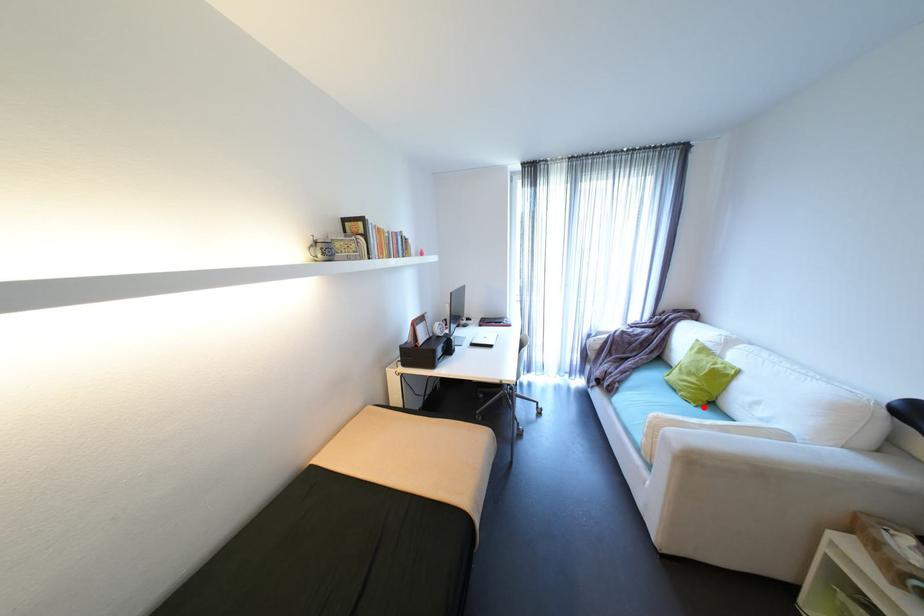
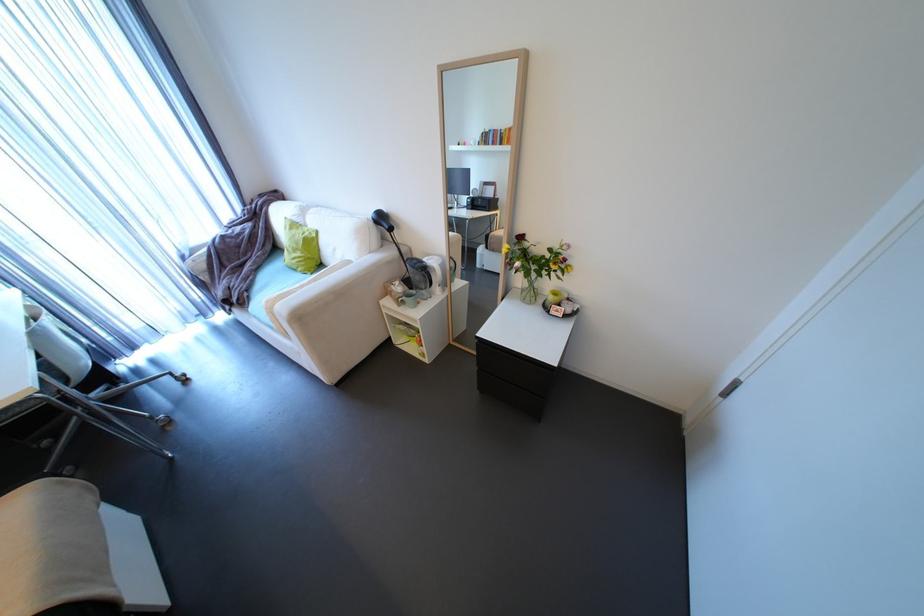
The point at the highlighted location is marked in the first image. Where is the corresponding point in the second image?

(319, 274)